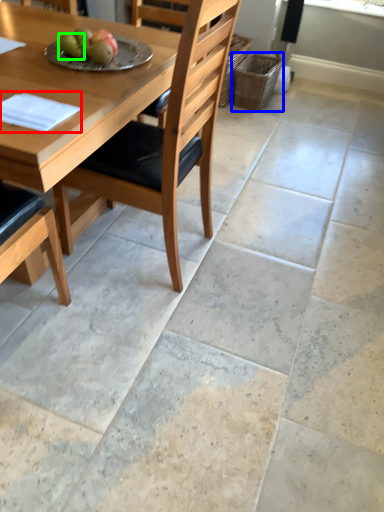
Question: Estimate the real-world distances between objects in this image. Which object is farther from pad (highlighted by a red box), basket (highlighted by a blue box) or fruit (highlighted by a green box)?

Choices:
 (A) basket
 (B) fruit

Answer: (A)